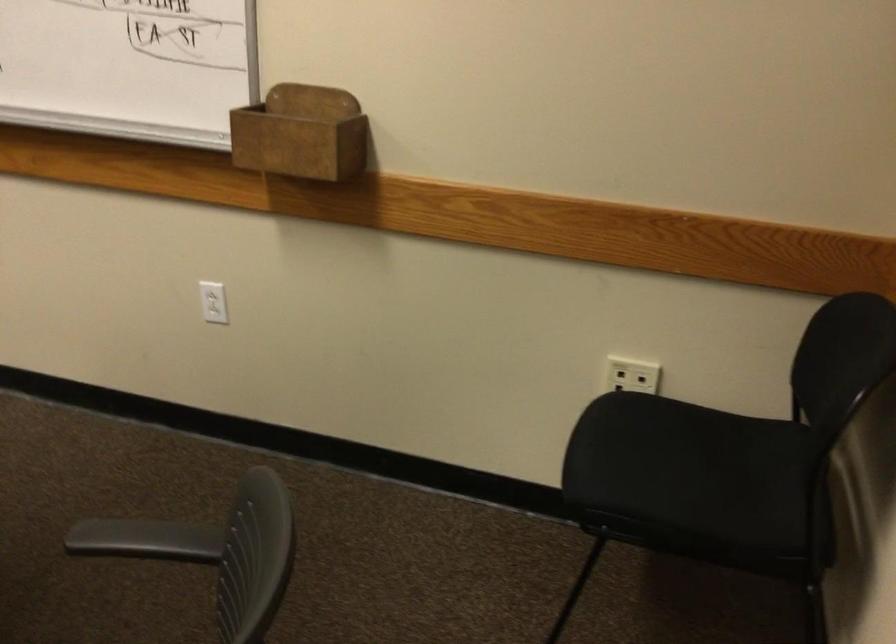
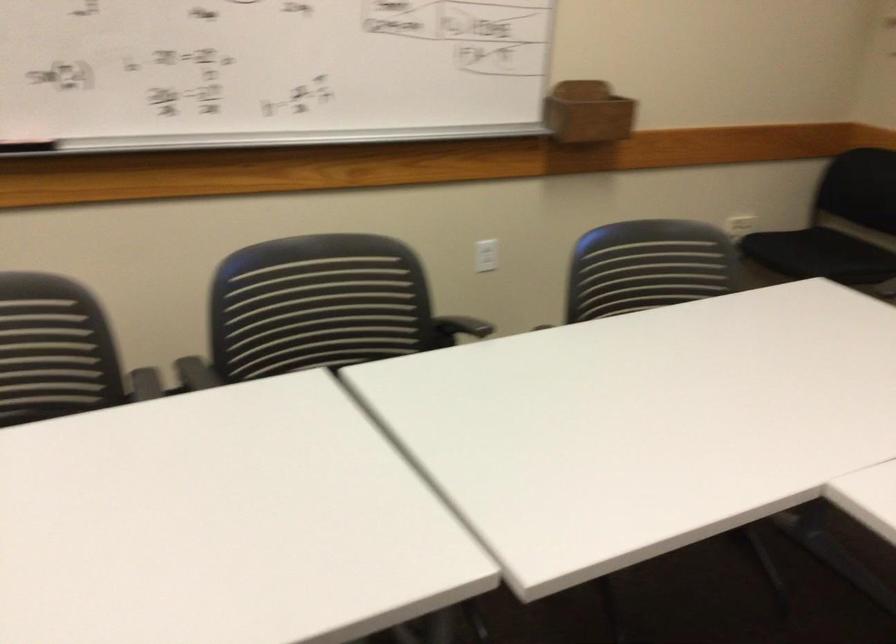
Locate, in the second image, the point that corresponds to point (270, 135) in the first image.

(588, 111)